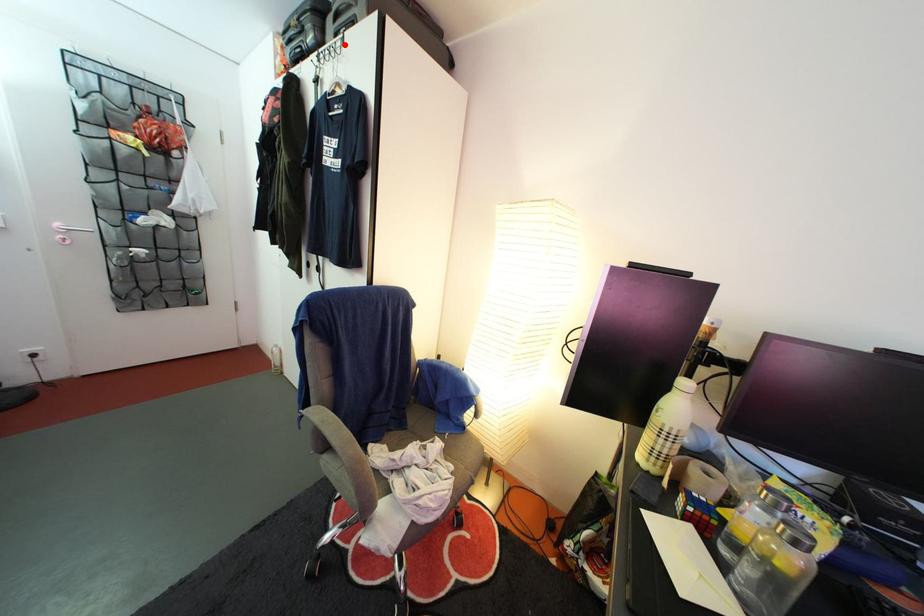
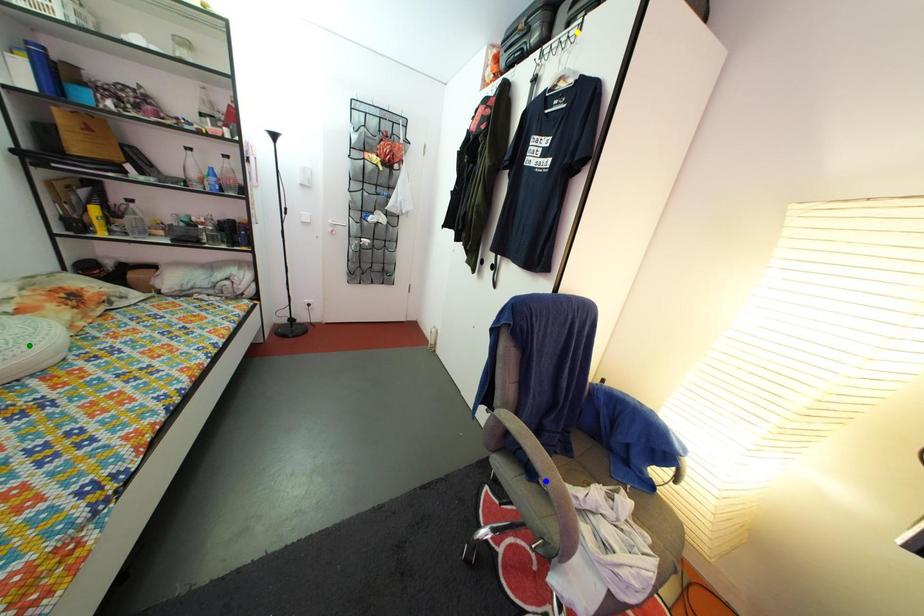
Question: I am providing you with two images of the same scene from different viewpoints. A red point is marked on the first image. You are given multiple points on the second image. Which mark in image 2 goes with the point in image 1?

Choices:
 (A) yellow point
 (B) green point
 (C) blue point

Answer: (A)